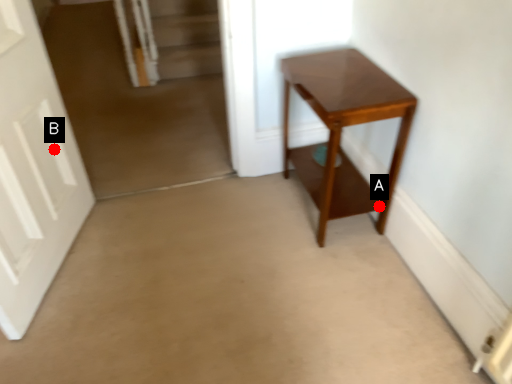
Question: Two points are circled on the image, labeled by A and B beside each circle. Among these points, which one is farthest from the camera?

Choices:
 (A) A is further
 (B) B is further

Answer: (A)